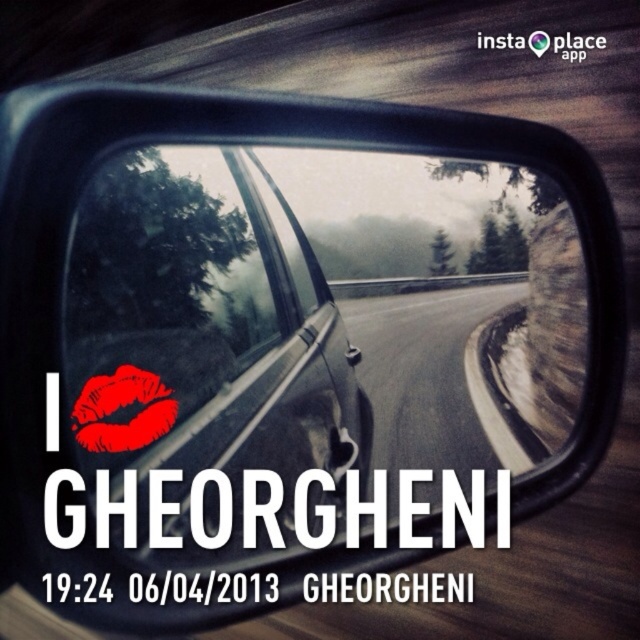
You are a driver checking your side mirror. You notice a point at coordinates (317,346) in the mirror. Based on the scene description, what object does this point most likely represent?

The point at coordinates (317,346) most likely represents the glossy metallic mirror at upper center, as the Objects Description states that this point indicates that object.

You are driving a car and want to check your side mirror to see if there is space to change lanes. Based on the scene, which object is closer to you, the glossy metallic mirror at upper center or the matte black car window at center?

The glossy metallic mirror at upper center is closer to you than the matte black car window at center.

You are a delivery person who needs to place a box between the glossy metallic mirror at upper center and the matte black car window at center. The box requires 3 meters of space. Can you fit it there?

The glossy metallic mirror at upper center is 3.62 meters away from the matte black car window at center, so yes, the box requiring 3 meters of space can fit between them since the distance is sufficient.